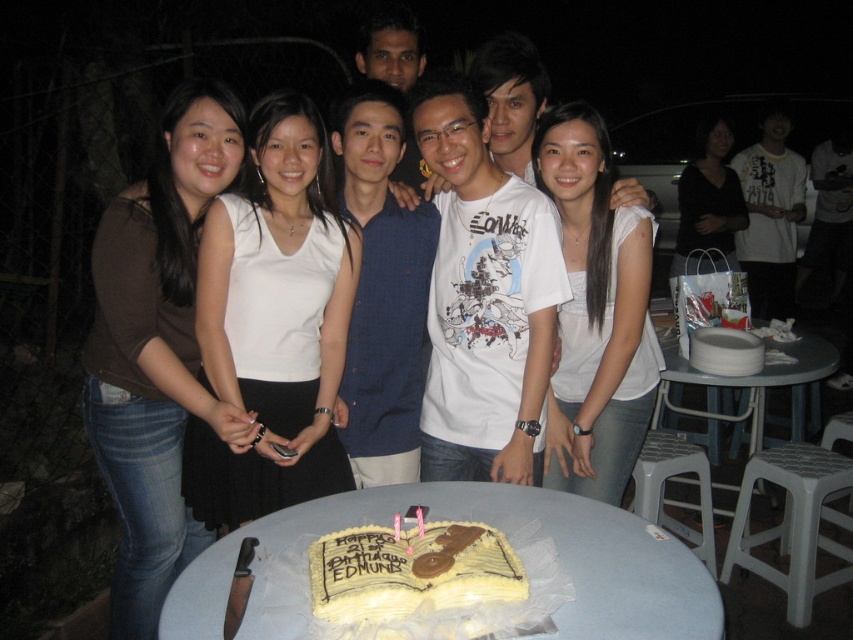
Question: Can you confirm if white matte tank top at center is positioned to the right of yellow fondant cake at center?

Choices:
 (A) no
 (B) yes

Answer: (A)

Question: Can you confirm if matte black shirt at center is positioned to the left of gray plastic stool at lower right?

Choices:
 (A) yes
 (B) no

Answer: (B)

Question: Which point appears closest to the camera in this image?

Choices:
 (A) (804, 595)
 (B) (677, 230)
 (C) (479, 557)
 (D) (705, 394)

Answer: (C)

Question: Which object appears farthest from the camera in this image?

Choices:
 (A) gray plastic stool at lower right
 (B) white plastic table at center
 (C) yellow fondant cake at center

Answer: (A)

Question: Is brown fabric shirt at left closer to the viewer compared to white matte shirt at center?

Choices:
 (A) no
 (B) yes

Answer: (B)

Question: Which point is closer to the camera?

Choices:
 (A) (300, 198)
 (B) (791, 531)

Answer: (A)